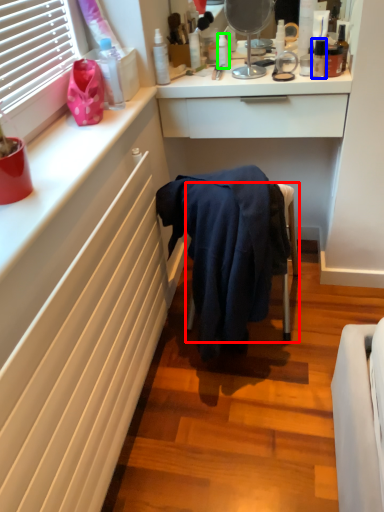
Question: Which is nearer to the furniture (highlighted by a red box)? toiletry (highlighted by a blue box) or toiletry (highlighted by a green box).

Choices:
 (A) toiletry
 (B) toiletry

Answer: (A)